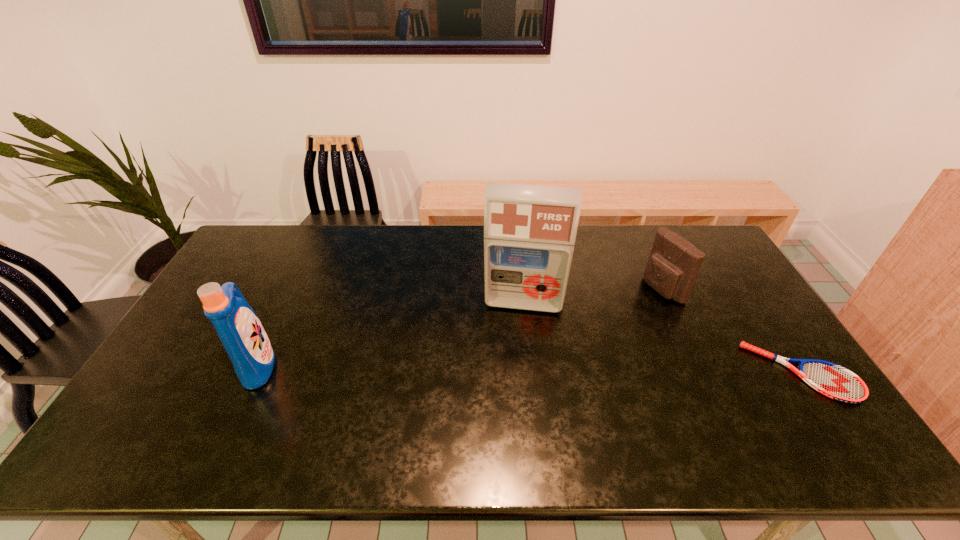
Image resolution: width=960 pixels, height=540 pixels. I want to click on free space located on the front-facing side of the tallest object, so click(x=514, y=376).

Where is `free location located on the front-facing side of the tallest object`? This screenshot has width=960, height=540. free location located on the front-facing side of the tallest object is located at coordinates (516, 348).

Locate an element on the screen. free spot located 0.360m on the front-facing side of the tallest object is located at coordinates (510, 420).

Find the location of a particular element. The image size is (960, 540). free space located 0.050m with an open flap on the pouch is located at coordinates (639, 303).

You are a GUI agent. You are given a task and a screenshot of the screen. Output one action in this format:
    pyautogui.click(x=<x>, y=<y>)
    Task: Click on the vacant space situated 0.140m with an open flap on the pouch
    The width and height of the screenshot is (960, 540).
    Given the screenshot: What is the action you would take?
    pyautogui.click(x=617, y=313)

Locate an element on the screen. free spot located 0.190m with an open flap on the pouch is located at coordinates (605, 319).

Locate an element on the screen. detergent that is at the near edge is located at coordinates (238, 327).

At what (x,y) coordinates should I click in order to perform the action: click on tennis racket at the near edge. Please return your answer as a coordinate pair (x, y). The width and height of the screenshot is (960, 540). Looking at the image, I should click on pyautogui.click(x=834, y=381).

I want to click on object present at the right edge, so click(x=834, y=381).

The height and width of the screenshot is (540, 960). I want to click on object located in the near right corner section of the desktop, so [x=834, y=381].